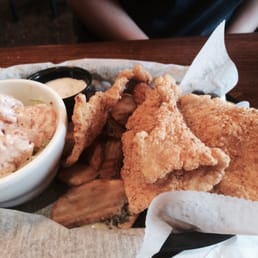
Locate an element on the screen. Image resolution: width=258 pixels, height=258 pixels. black plastic basket is located at coordinates (191, 241).